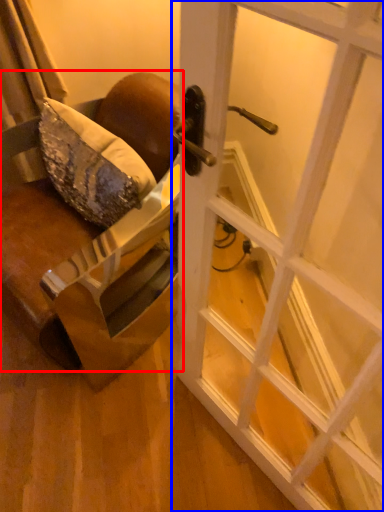
Question: Which point is closer to the camera, chair (highlighted by a red box) or door (highlighted by a blue box)?

Choices:
 (A) chair
 (B) door

Answer: (B)